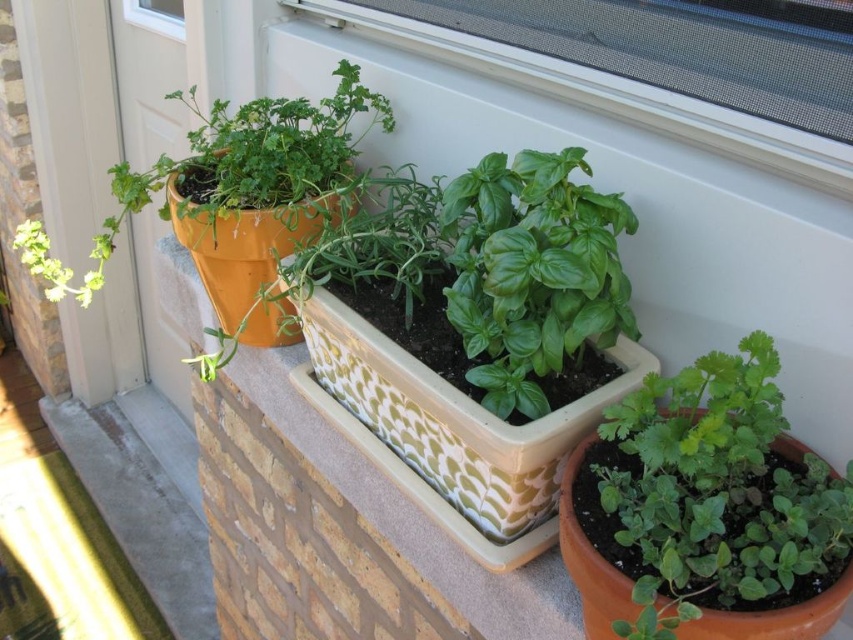
Question: Which of the following is the farthest from the observer?

Choices:
 (A) matte orange pot at left
 (B) transparent plastic window at upper center

Answer: (A)

Question: Is matte orange pot at left wider than transparent plastic window at upper center?

Choices:
 (A) no
 (B) yes

Answer: (A)

Question: Is white textured rectangular planter at center in front of transparent plastic window at upper center?

Choices:
 (A) no
 (B) yes

Answer: (A)

Question: Which point appears closest to the camera in this image?

Choices:
 (A) (578, 237)
 (B) (746, 161)
 (C) (769, 374)
 (D) (407, 397)

Answer: (C)

Question: Which point appears closest to the camera in this image?

Choices:
 (A) (540, 300)
 (B) (767, 458)

Answer: (B)

Question: Is green glossy basil at center above transparent plastic window at upper center?

Choices:
 (A) no
 (B) yes

Answer: (A)